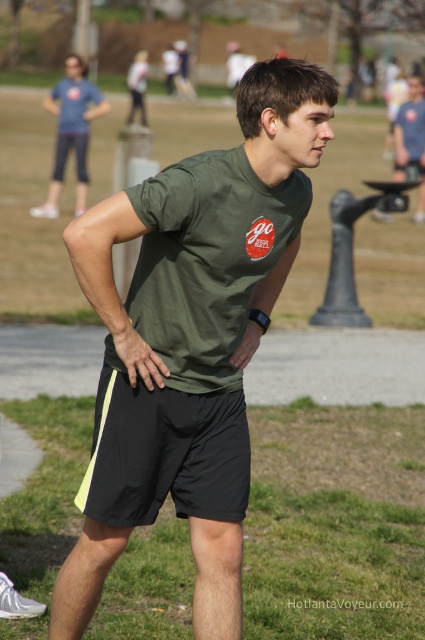
Question: Is green matte shorts at lower center above black/waterproof shorts at center?

Choices:
 (A) no
 (B) yes

Answer: (A)

Question: Among these points, which one is nearest to the camera?

Choices:
 (A) (223, 253)
 (B) (34, 209)
 (C) (124, 513)
 (D) (53, 554)

Answer: (A)

Question: Is black/waterproof shorts at center in front of matte blue jeans at upper left?

Choices:
 (A) no
 (B) yes

Answer: (B)

Question: Among these objects, which one is nearest to the camera?

Choices:
 (A) green matte shorts at lower center
 (B) matte blue jeans at upper left

Answer: (A)

Question: Which object is closer to the camera taking this photo?

Choices:
 (A) matte blue jeans at upper left
 (B) black/waterproof shorts at center
 (C) green matte shorts at lower center
 (D) green matte t-shirt at center

Answer: (D)

Question: From the image, what is the correct spatial relationship of green matte t-shirt at center in relation to matte blue jeans at upper left?

Choices:
 (A) right
 (B) left

Answer: (A)